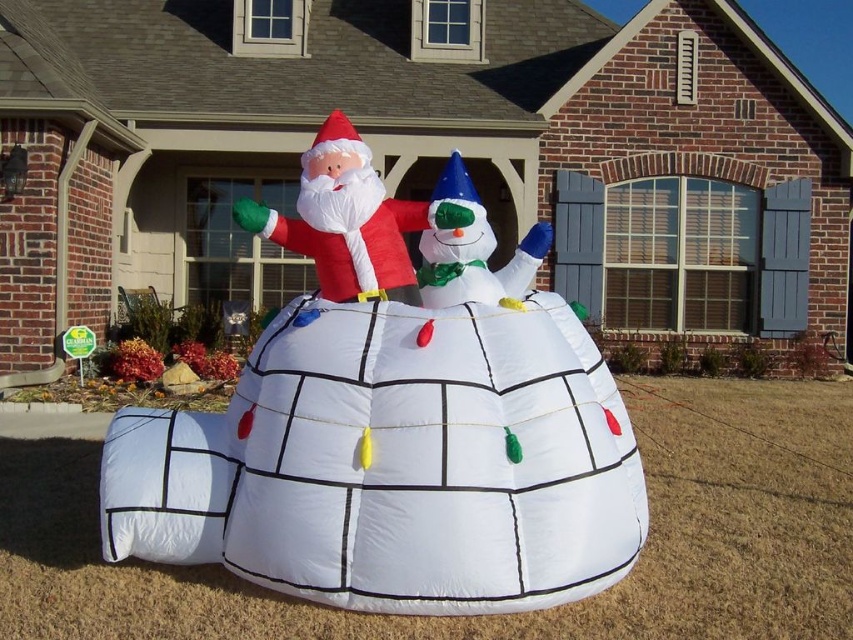
You are a delivery person trying to place a package on the roof of the igloo. The package is 1 meter tall. Can you place it there without touching the white inflatable snowman at center or the matte red santa at center?

The white inflatable snowman at center is positioned under the matte red santa at center, so the snowman is below the Santa. Since the package is 1 meter tall, it can be placed on the roof between them without touching either.

You are standing in front of the festive igloo decoration. You see a white inflatable snowman at center and a matte red santa at center. Which one is positioned to the right?

The white inflatable snowman at center is positioned to the right of the matte red santa at center.